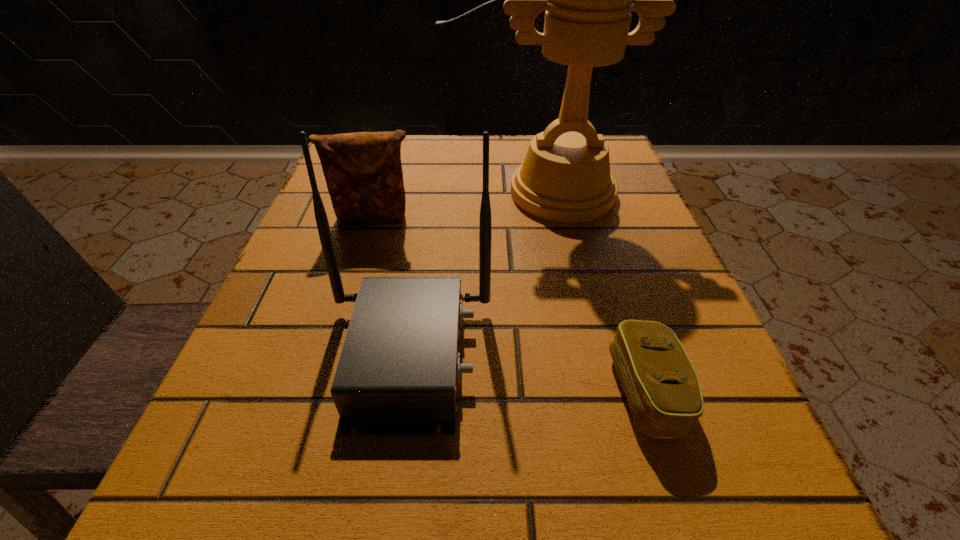
At what (x,y) coordinates should I click in order to perform the action: click on award. Please return your answer as a coordinate pair (x, y). Looking at the image, I should click on (565, 177).

The image size is (960, 540). What are the coordinates of `the second tallest object` in the screenshot? It's located at (398, 373).

This screenshot has width=960, height=540. I want to click on the left clutch bag, so click(x=363, y=171).

Where is `the third tallest object`? The image size is (960, 540). the third tallest object is located at coordinates (363, 171).

The width and height of the screenshot is (960, 540). What are the coordinates of `the shorter clutch bag` in the screenshot? It's located at (661, 385).

I want to click on the nearer clutch bag, so click(x=661, y=385).

This screenshot has height=540, width=960. I want to click on free spot located on the left of the award, so click(x=341, y=193).

I want to click on vacant space situated on the back of the router to connect cables, so click(644, 354).

Locate an element on the screen. The height and width of the screenshot is (540, 960). vacant position located 0.160m on the open side of the taller clutch bag is located at coordinates (353, 293).

The height and width of the screenshot is (540, 960). What are the coordinates of `vacant space located 0.300m on the zipper side of the right clutch bag` in the screenshot? It's located at (378, 392).